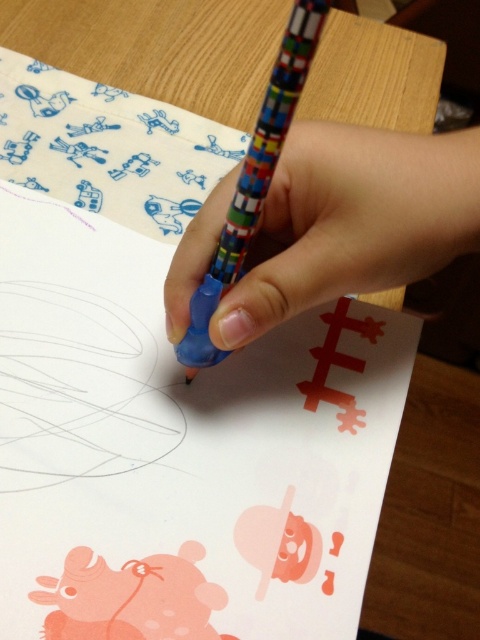
Is rubberized plastic pencil at center wider than multicolored plastic pencil at center?

Correct, the width of rubberized plastic pencil at center exceeds that of multicolored plastic pencil at center.

Does rubberized plastic pencil at center have a smaller size compared to multicolored plastic pencil at center?

Actually, rubberized plastic pencil at center might be larger than multicolored plastic pencil at center.

Who is more distant from viewer, (x=393, y=211) or (x=307, y=3)?

The point (x=393, y=211) is more distant.

Locate an element on the screen. rubberized plastic pencil at center is located at coordinates (352, 221).